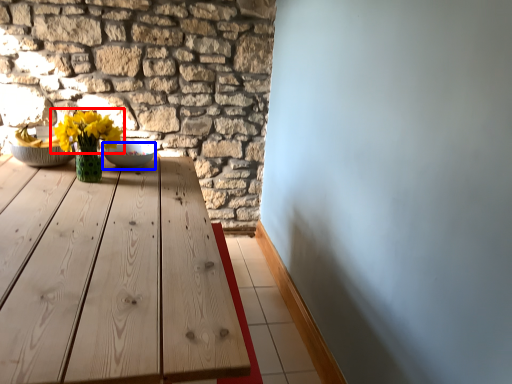
Question: Which point is closer to the camera, flower (highlighted by a red box) or bowl (highlighted by a blue box)?

Choices:
 (A) flower
 (B) bowl

Answer: (A)